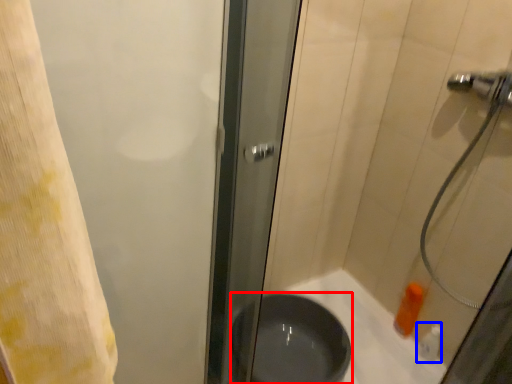
Question: Among these objects, which one is farthest to the camera, basin (highlighted by a red box) or toiletry (highlighted by a blue box)?

Choices:
 (A) basin
 (B) toiletry

Answer: (B)